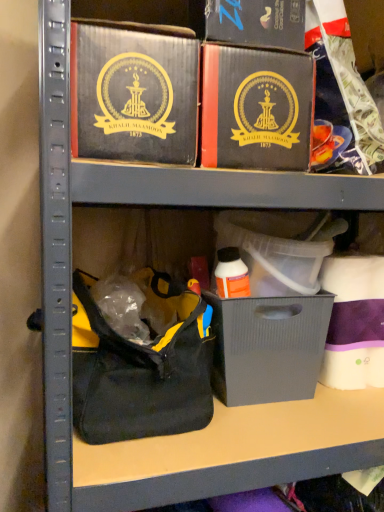
Question: Would you say matte black box at upper center is a long distance from matte gray plastic bin at center?

Choices:
 (A) yes
 (B) no

Answer: (B)

Question: Is the surface of matte black box at upper center in direct contact with matte gray plastic bin at center?

Choices:
 (A) yes
 (B) no

Answer: (B)

Question: Is matte black box at upper center aimed at matte gray plastic bin at center?

Choices:
 (A) no
 (B) yes

Answer: (A)

Question: Can we say matte black box at upper center lies outside matte gray plastic bin at center?

Choices:
 (A) yes
 (B) no

Answer: (A)

Question: Considering the relative positions of matte black box at upper center and matte gray plastic bin at center in the image provided, is matte black box at upper center to the left of matte gray plastic bin at center from the viewer's perspective?

Choices:
 (A) yes
 (B) no

Answer: (B)

Question: Considering the positions of point (279, 105) and point (167, 105), is point (279, 105) closer or farther from the camera than point (167, 105)?

Choices:
 (A) closer
 (B) farther

Answer: (B)

Question: From the image's perspective, is matte black box at center, marked as the 2th box in a left-to-right arrangement, above or below matte black box at upper center, the second box in the right-to-left sequence?

Choices:
 (A) above
 (B) below

Answer: (B)

Question: In the image, is matte black box at center, marked as the 2th box in a left-to-right arrangement, on the left side or the right side of matte black box at upper center, the second box in the right-to-left sequence?

Choices:
 (A) right
 (B) left

Answer: (A)

Question: Considering the positions of matte black box at center, marked as the 2th box in a left-to-right arrangement, and matte black box at upper center, the second box in the right-to-left sequence, in the image, is matte black box at center, marked as the 2th box in a left-to-right arrangement, taller or shorter than matte black box at upper center, the second box in the right-to-left sequence,?

Choices:
 (A) tall
 (B) short

Answer: (A)

Question: Is matte black box at upper center bigger or smaller than black fabric handbag at lower left?

Choices:
 (A) big
 (B) small

Answer: (B)

Question: In terms of width, does matte black box at upper center look wider or thinner when compared to black fabric handbag at lower left?

Choices:
 (A) thin
 (B) wide

Answer: (A)

Question: Is matte black box at upper center inside or outside of black fabric handbag at lower left?

Choices:
 (A) inside
 (B) outside

Answer: (B)

Question: From the image's perspective, is matte black box at upper center located above or below black fabric handbag at lower left?

Choices:
 (A) below
 (B) above

Answer: (B)

Question: Considering the relative positions of matte black box at upper center, the second box in the right-to-left sequence, and matte black box at center, marked as the 2th box in a left-to-right arrangement, in the image provided, is matte black box at upper center, the second box in the right-to-left sequence, to the left or to the right of matte black box at center, marked as the 2th box in a left-to-right arrangement,?

Choices:
 (A) left
 (B) right

Answer: (A)

Question: Is point (142, 97) positioned closer to the camera than point (294, 108)?

Choices:
 (A) farther
 (B) closer

Answer: (B)